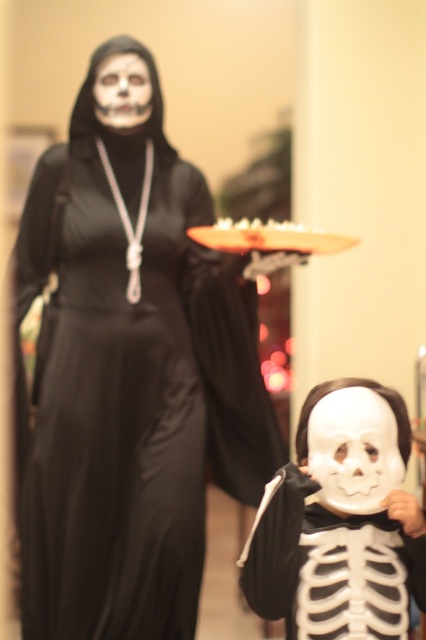
Can you confirm if black satin dress at upper left is smaller than white matte mask at lower center?

Actually, black satin dress at upper left might be larger than white matte mask at lower center.

Is point (94, 218) closer to camera compared to point (337, 595)?

No.

What do you see at coordinates (129, 372) in the screenshot? I see `black satin dress at upper left` at bounding box center [129, 372].

Locate an element on the screen. Image resolution: width=426 pixels, height=640 pixels. black satin dress at upper left is located at coordinates (129, 372).